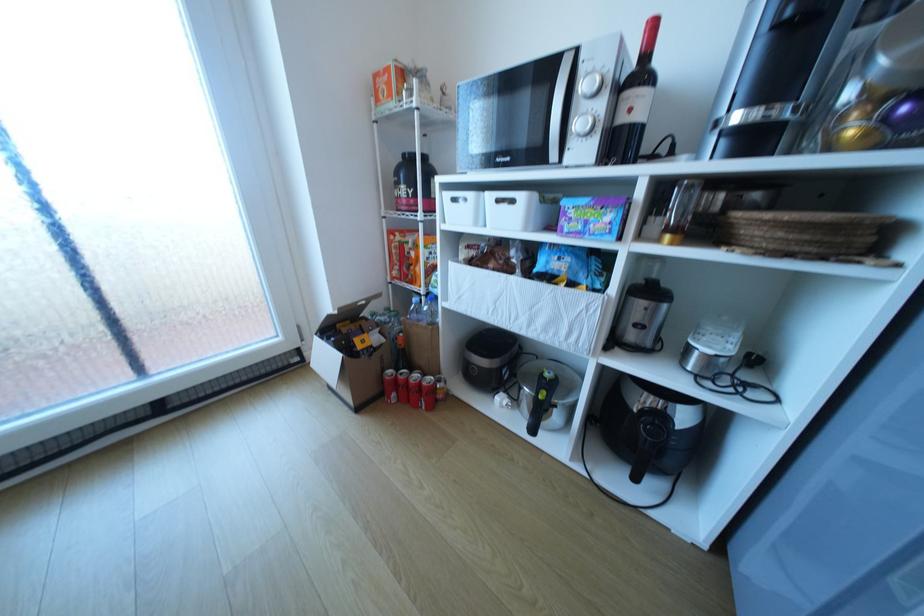
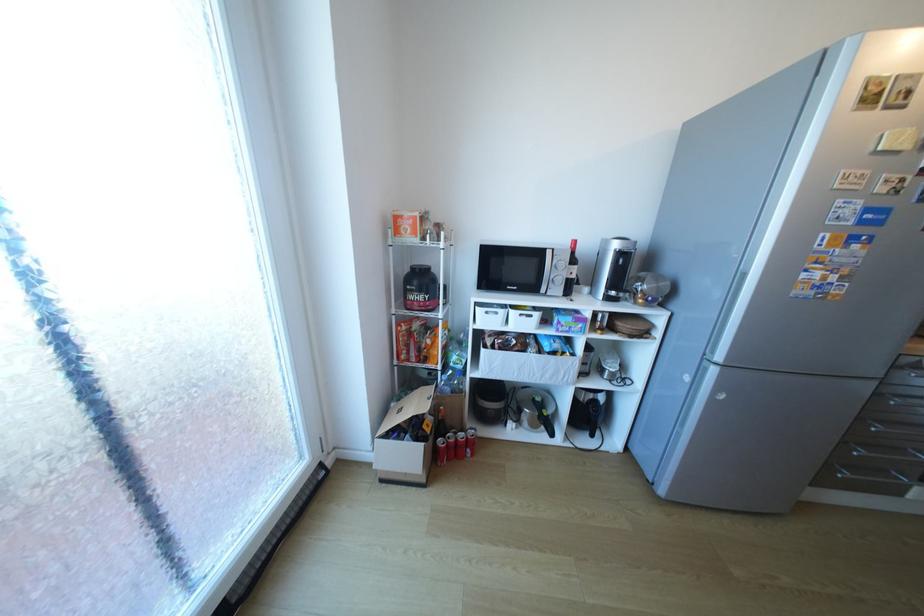
Where in the second image is the point corresponding to (x=431, y=487) from the first image?

(523, 504)